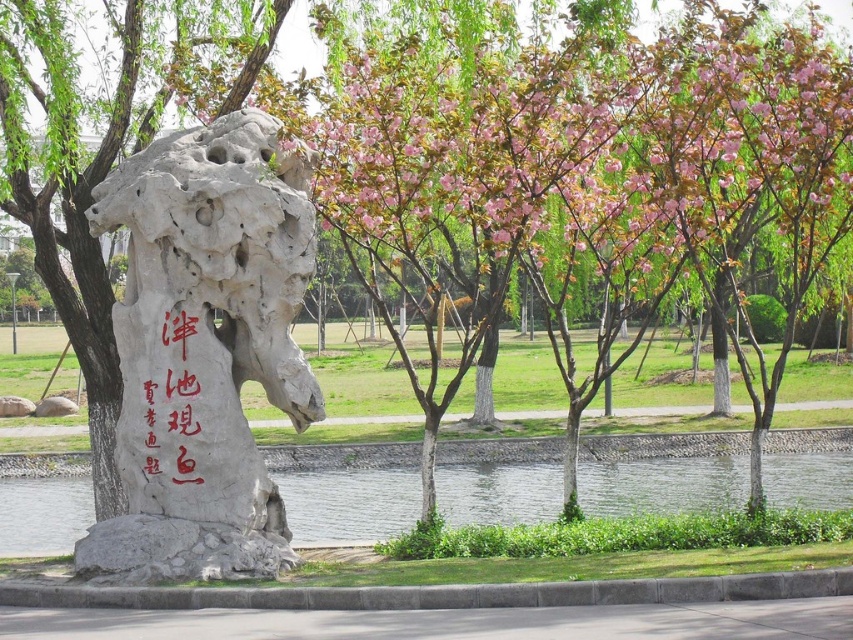
Question: Which point is farther to the camera?

Choices:
 (A) clear water at center
 (B) red calligraphy stone at center
 (C) natural stone rock at center

Answer: (A)

Question: Where is natural stone rock at center located in relation to red calligraphy stone at center in the image?

Choices:
 (A) right
 (B) left

Answer: (A)

Question: Which object appears farthest from the camera in this image?

Choices:
 (A) natural stone rock at center
 (B) clear water at center

Answer: (B)

Question: Is clear water at center positioned in front of red calligraphy stone at center?

Choices:
 (A) no
 (B) yes

Answer: (A)

Question: Can you confirm if natural stone rock at center is wider than red calligraphy stone at center?

Choices:
 (A) no
 (B) yes

Answer: (A)

Question: Which point is closer to the camera taking this photo?

Choices:
 (A) (152, 380)
 (B) (227, 310)

Answer: (A)